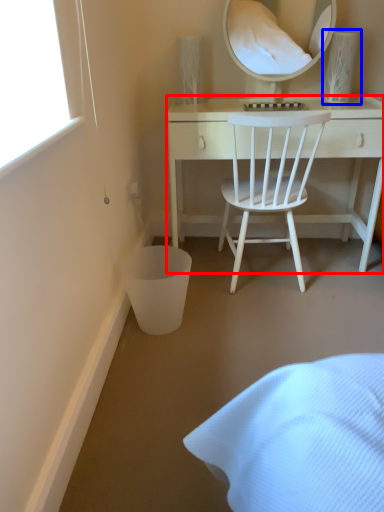
Question: Which object is closer to the camera taking this photo, desk (highlighted by a red box) or table lamp (highlighted by a blue box)?

Choices:
 (A) desk
 (B) table lamp

Answer: (A)